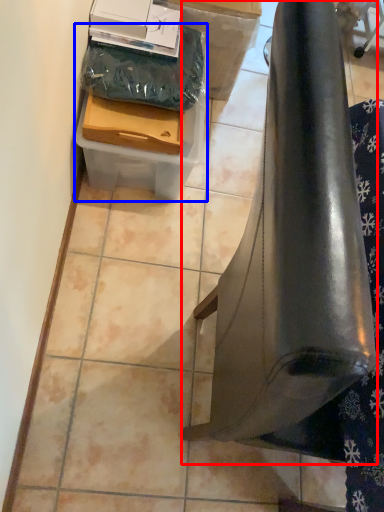
Question: Which point is further to the camera, furniture (highlighted by a red box) or box (highlighted by a blue box)?

Choices:
 (A) furniture
 (B) box

Answer: (B)